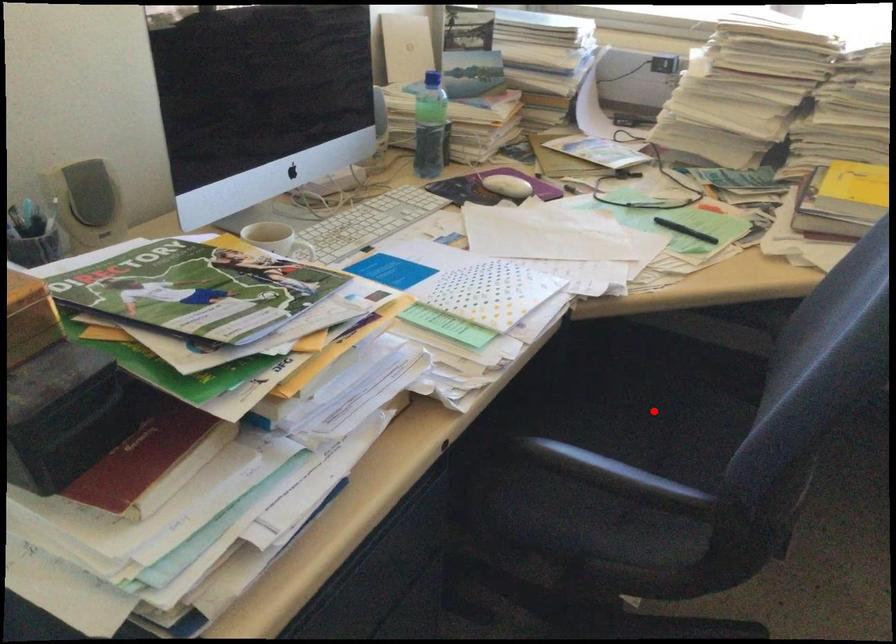
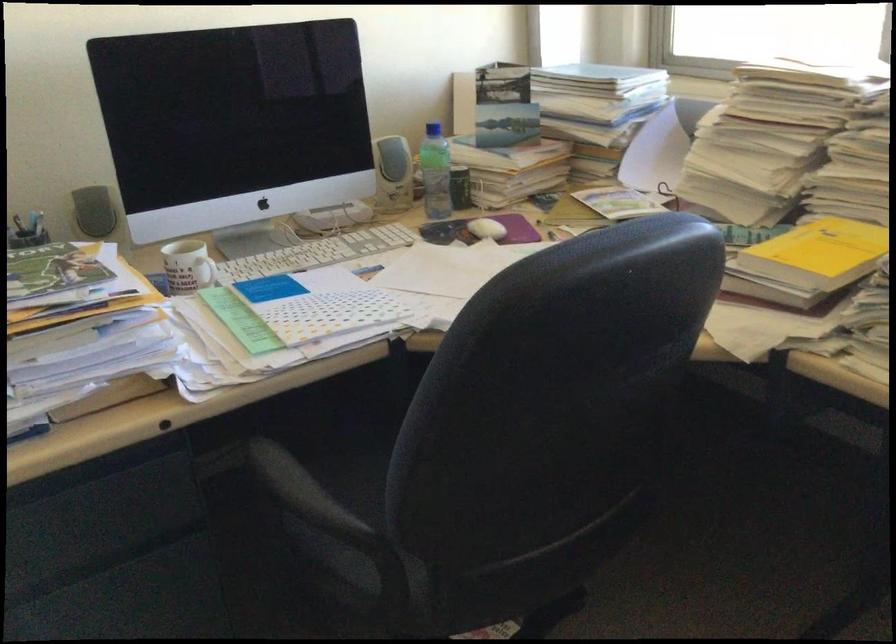
Question: I am providing you with two images of the same scene from different viewpoints. A red point is marked on the first image. Is the red point's position out of view in image 2?

Choices:
 (A) Yes
 (B) No

Answer: (A)